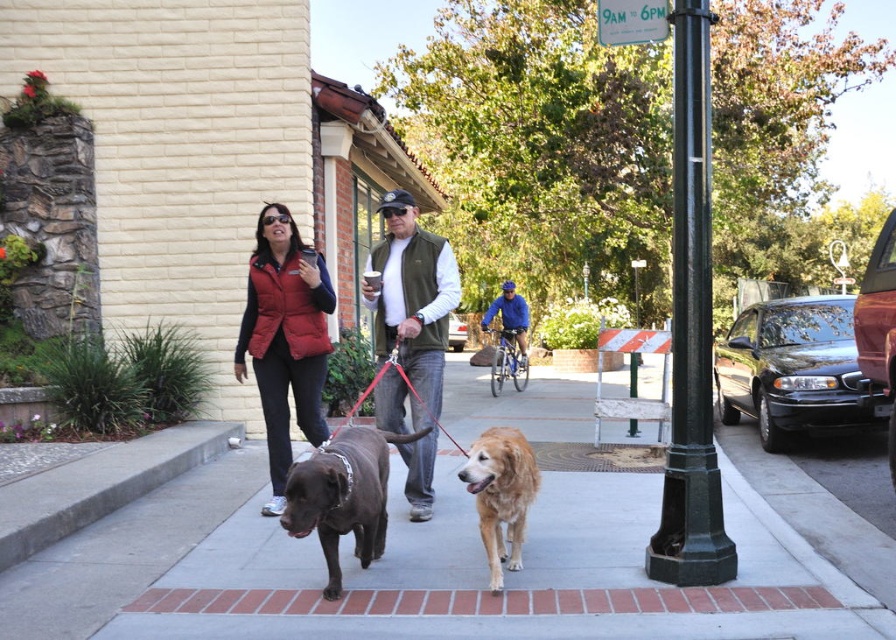
Question: Does matte red vest at center have a larger size compared to matte green vest at center?

Choices:
 (A) no
 (B) yes

Answer: (A)

Question: Can you confirm if matte green vest at center is positioned below blue fabric helmet at center?

Choices:
 (A) no
 (B) yes

Answer: (B)

Question: Based on their relative distances, which object is farther from the red puffy vest at center?

Choices:
 (A) concrete sidewalk at center
 (B) shiny brown dog at center

Answer: (A)

Question: Based on their relative distances, which object is farther from the shiny brown dog at center?

Choices:
 (A) red puffy vest at center
 (B) matte red vest at center
 (C) blue fabric helmet at center

Answer: (C)

Question: Considering the real-world distances, which object is farthest from the concrete sidewalk at center?

Choices:
 (A) golden matte dog at center
 (B) shiny brown dog at center
 (C) matte red vest at center

Answer: (C)

Question: Is red puffy vest at center bigger than blue fabric helmet at center?

Choices:
 (A) yes
 (B) no

Answer: (B)